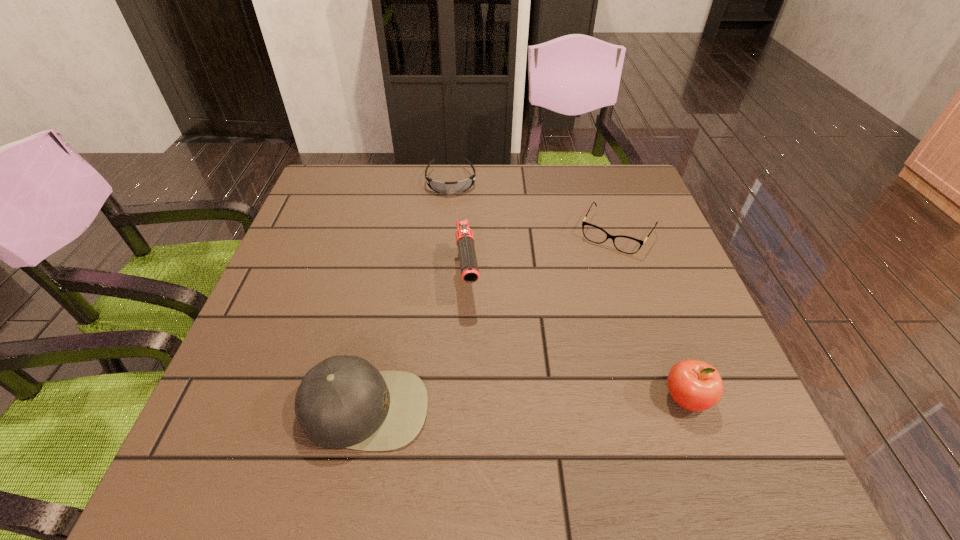
I want to click on vacant position in the image that satisfies the following two spatial constraints: 1. on the front side of the spectacles; 2. on the right side of the apple, so click(x=673, y=398).